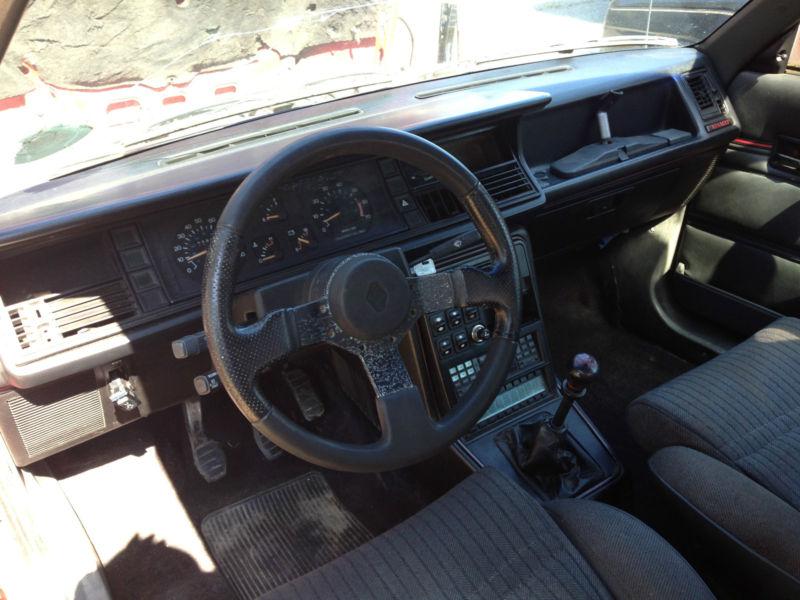
Locate an element on the screen. Image resolution: width=800 pixels, height=600 pixels. right door is located at coordinates (750, 211).